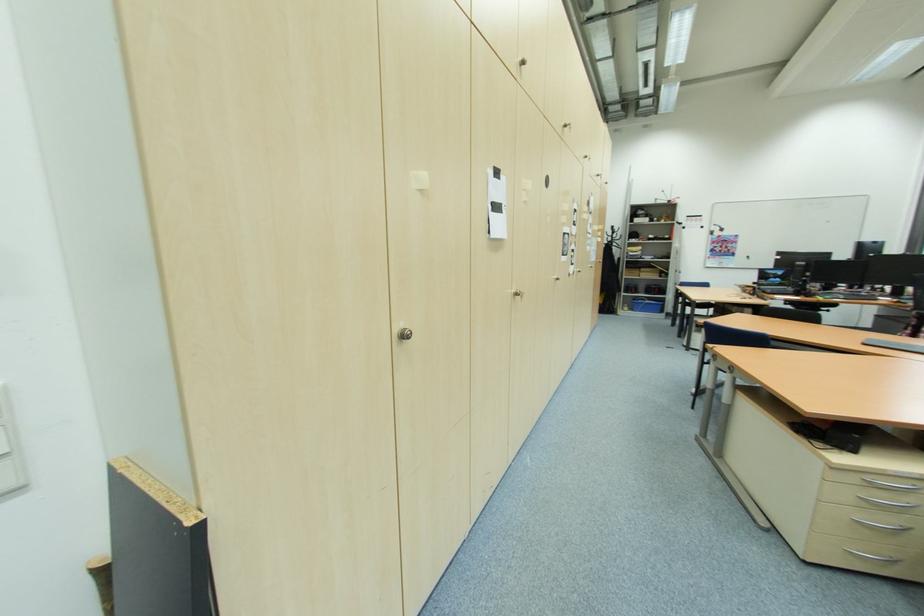
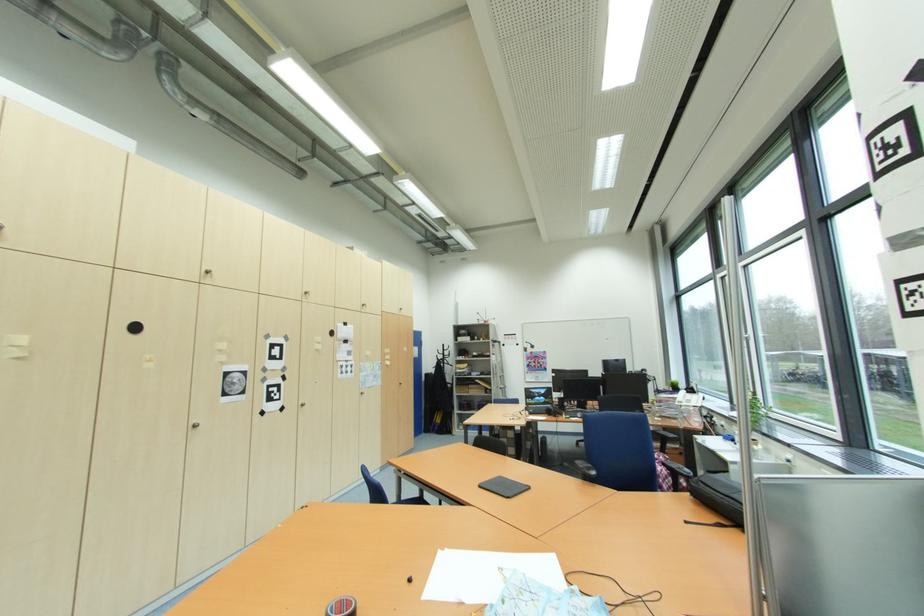
Find the pixel in the second image that matches (x=869, y=345) in the first image.

(484, 487)